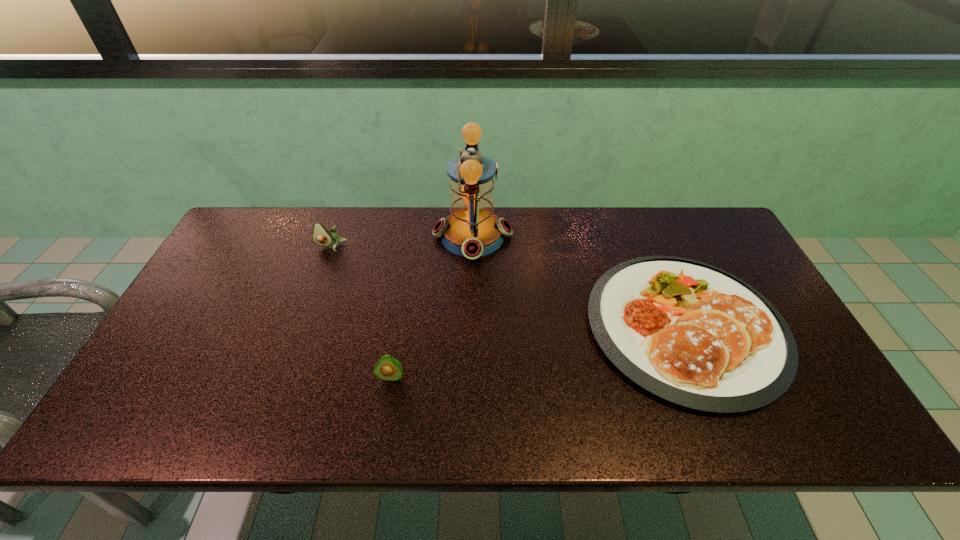
Image resolution: width=960 pixels, height=540 pixels. I want to click on the second object from right to left, so click(x=472, y=230).

Where is `lantern`? This screenshot has width=960, height=540. lantern is located at coordinates (472, 230).

Locate an element on the screen. This screenshot has width=960, height=540. the left avocado is located at coordinates (321, 236).

Identify the location of the farther avocado. (321, 236).

Identify the location of the right avocado. (388, 368).

You are a GUI agent. You are given a task and a screenshot of the screen. Output one action in this format:
    pyautogui.click(x=<x>, y=<y>)
    Task: Click on the nearer avocado
    
    Given the screenshot: What is the action you would take?
    [388, 368]

Where is `dish`? This screenshot has width=960, height=540. dish is located at coordinates (690, 333).

Locate an element on the screen. This screenshot has width=960, height=540. the rightmost object is located at coordinates (690, 333).

Where is `blank space located on the front-facing side of the lantern`? The image size is (960, 540). blank space located on the front-facing side of the lantern is located at coordinates (564, 236).

You are a GUI agent. You are given a task and a screenshot of the screen. Output one action in this format:
    pyautogui.click(x=<x>, y=<y>)
    Task: Click on the blank space located on the seed side of the leftmost object
    
    Given the screenshot: What is the action you would take?
    pyautogui.click(x=322, y=272)